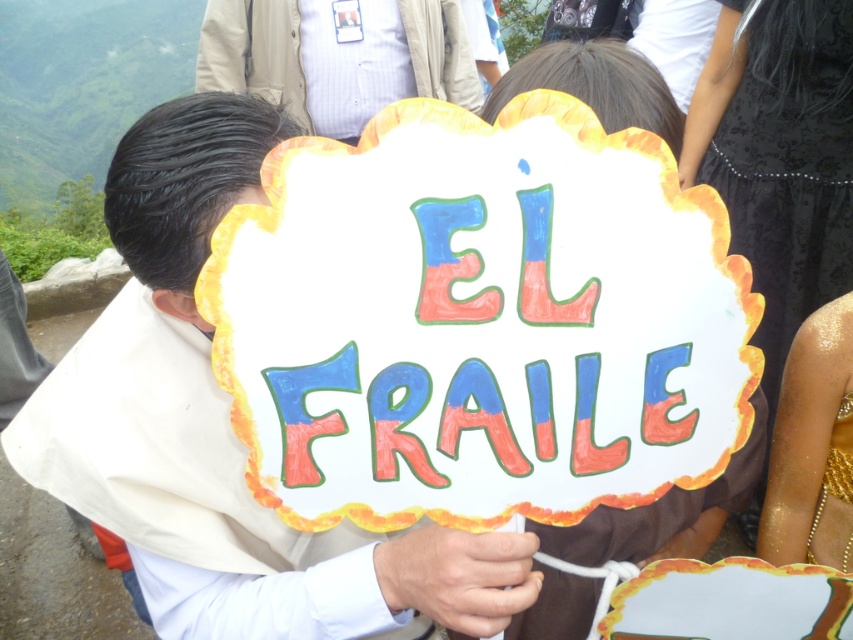
You are a photographer trying to capture the white paper sign at center and the light brown jacket at center in a single shot. Can you focus on both objects clearly at the same time?

The white paper sign at center is in front of the light brown jacket at center, so focusing on both clearly at the same time may be challenging due to their different distances from the camera.

You are standing at the position of the person holding the sign and want to know how far the point at coordinates point (105, 481) is from you. Can you determine the distance?

The distance of point (105, 481) from camera is 32.64 inches.

You are a photographer trying to capture the white paper sign at center and the light brown jacket at center in the same frame. Based on their positions, which object should you focus on first to ensure both are in the shot?

Since the white paper sign at center is positioned on the right side of the light brown jacket at center, you should focus on the light brown jacket at center first as it is closer to the left, ensuring both objects remain in frame.